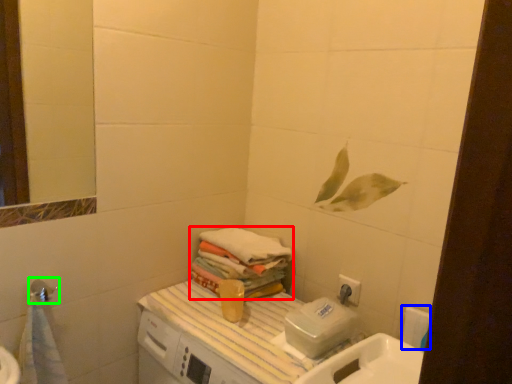
Question: Based on their relative distances, which object is farther from bath towel (highlighted by a red box)? Choose from toilet paper (highlighted by a blue box) and shower (highlighted by a green box).

Choices:
 (A) toilet paper
 (B) shower

Answer: (B)